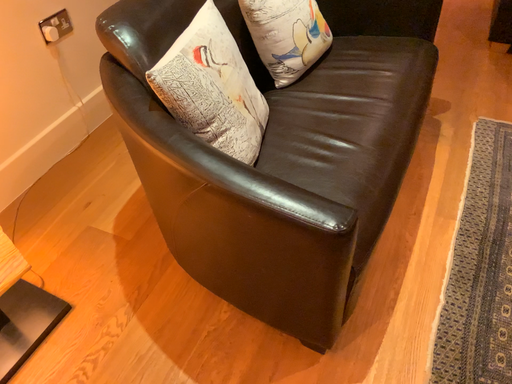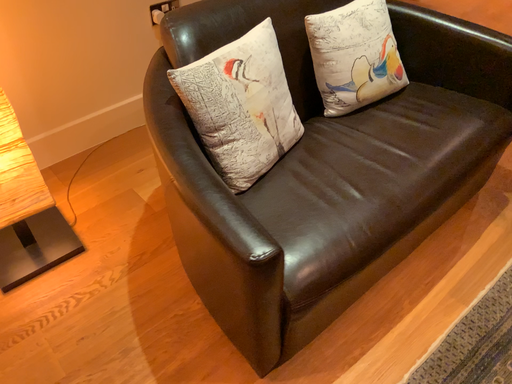
Question: Which way did the camera rotate in the video?

Choices:
 (A) rotated left
 (B) rotated right

Answer: (A)